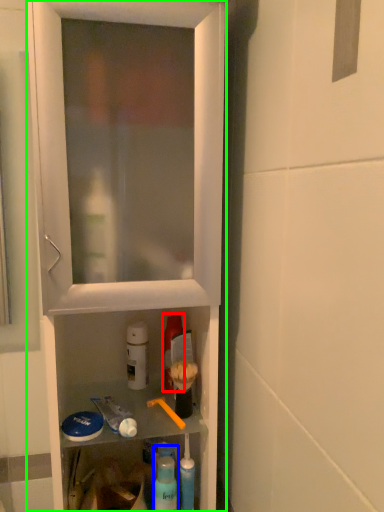
Question: Which object is positioned closest to mouthwash (highlighted by a red box)? Select from cleaning product (highlighted by a blue box) and cabinetry (highlighted by a green box).

Choices:
 (A) cleaning product
 (B) cabinetry

Answer: (A)